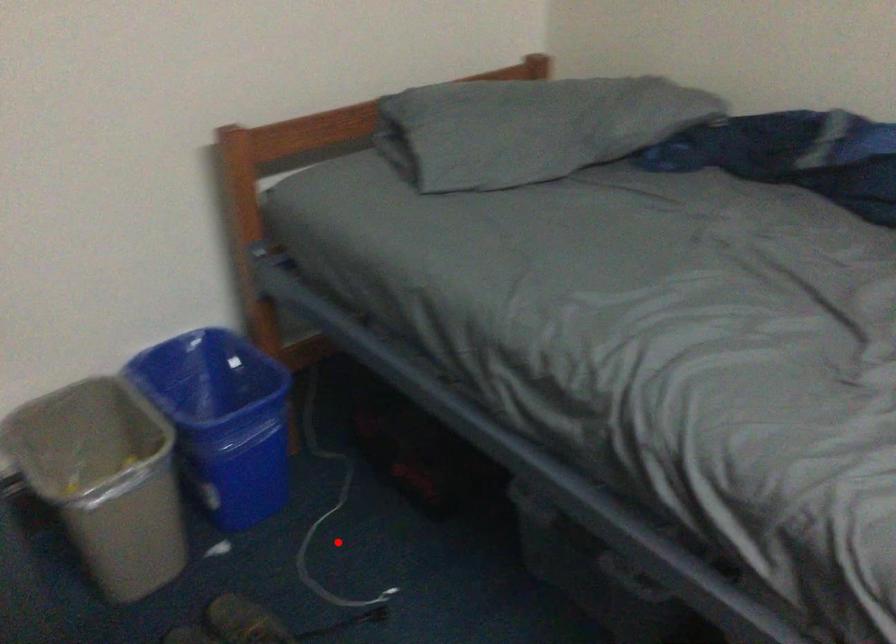
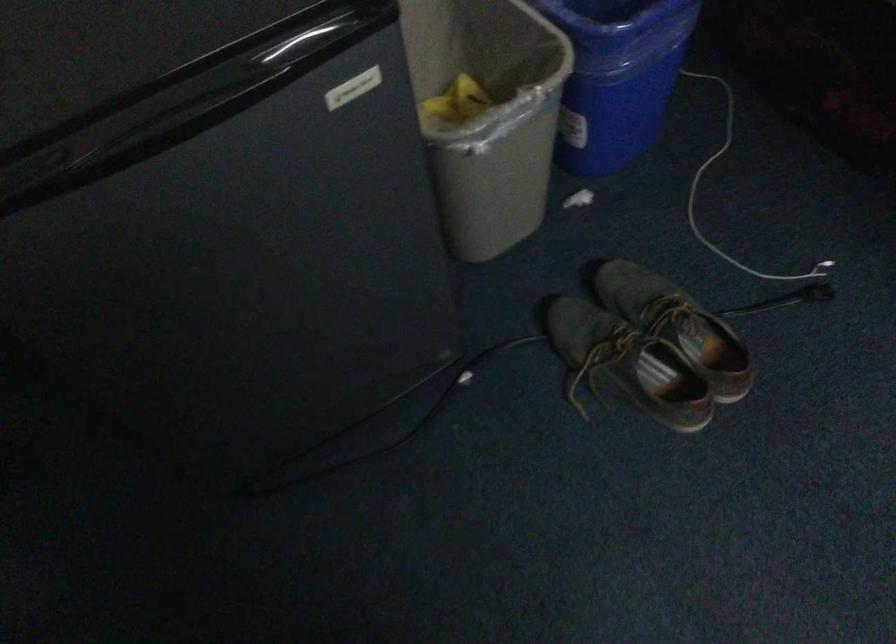
Question: I am providing you with two images of the same scene from different viewpoints. Given a red point in image1, look at the same physical point in image2. Is it:

Choices:
 (A) Closer to the viewpoint
 (B) Farther from the viewpoint

Answer: (A)